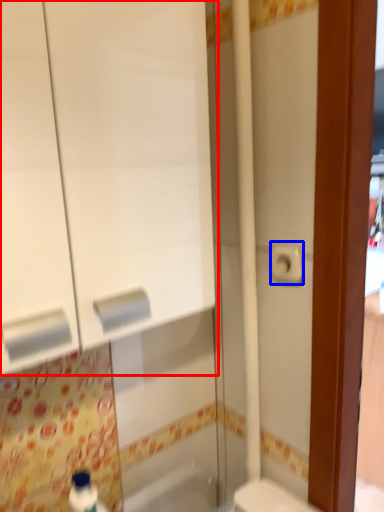
Question: Which of the following is the farthest to the observer, medicine cabinet (highlighted by a red box) or toilet paper (highlighted by a blue box)?

Choices:
 (A) medicine cabinet
 (B) toilet paper

Answer: (B)